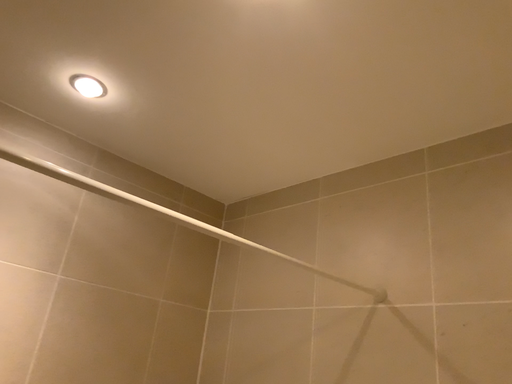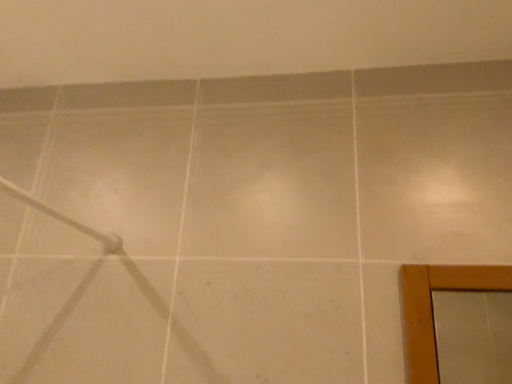
Question: Which way did the camera rotate in the video?

Choices:
 (A) rotated upward
 (B) rotated downward

Answer: (B)